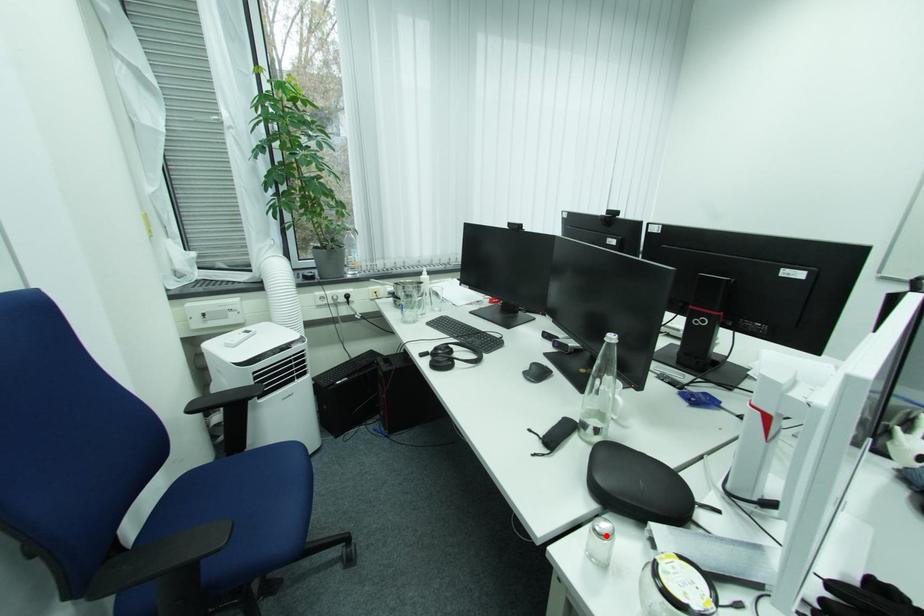
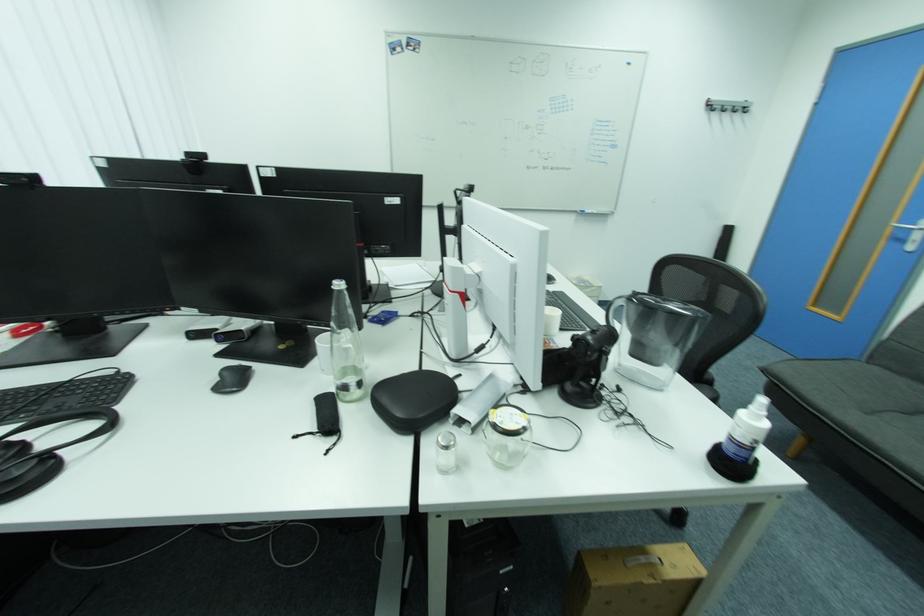
Locate, in the second image, the point that corresponds to the highlighted location in the first image.

(453, 448)